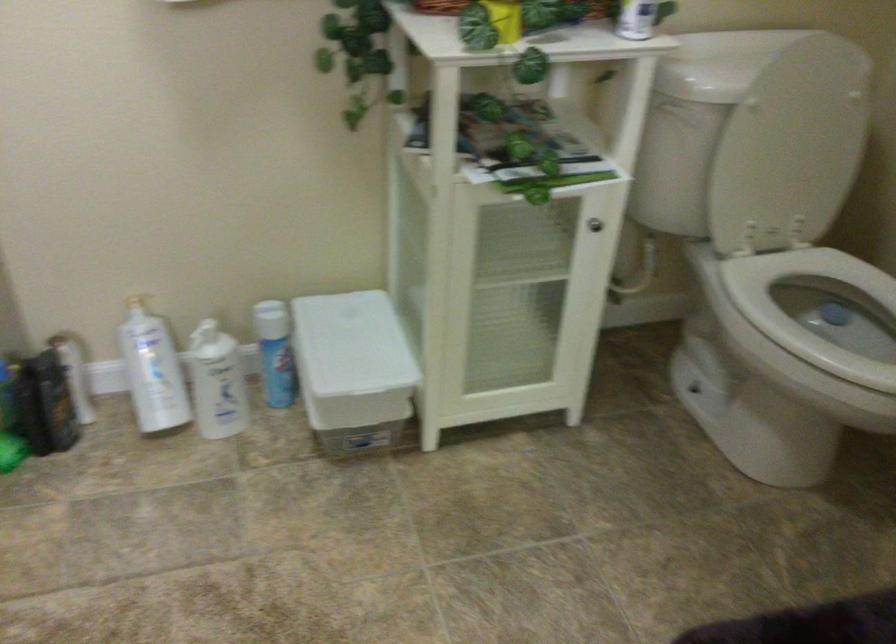
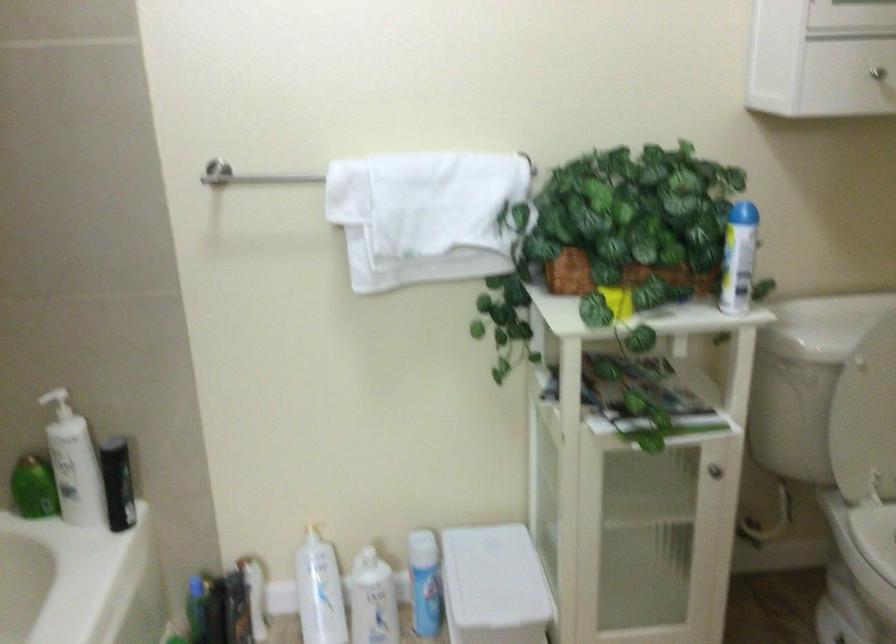
Question: Based on the continuous images, in which direction is the camera rotating? Reply with the corresponding letter.

Choices:
 (A) Left
 (B) Right
 (C) Up
 (D) Down

Answer: (C)